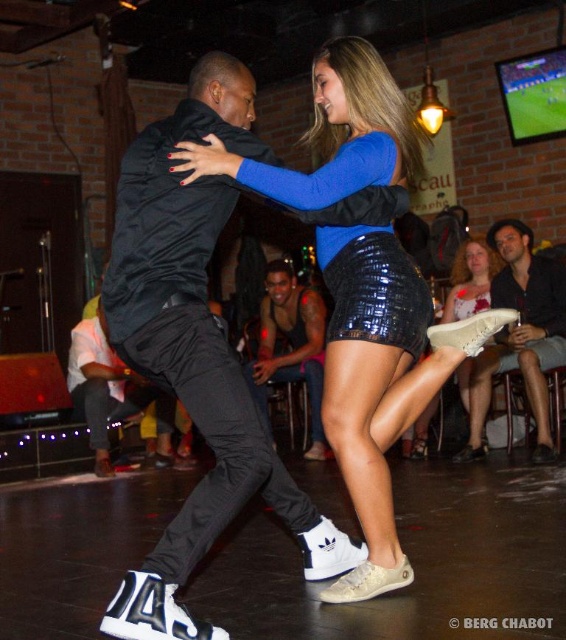
Who is positioned more to the right, black leather tank top at center or black matte pants at center?

black leather tank top at center

Does point (276, 321) come closer to viewer compared to point (74, 388)?

No, it is not.

The height and width of the screenshot is (640, 566). I want to click on black leather tank top at center, so click(291, 346).

Does point (374, 74) come in front of point (465, 268)?

That is True.

Is blue shiny skirt at center in front of white matte shoe at lower center?

Yes.

The width and height of the screenshot is (566, 640). In order to click on blue shiny skirt at center in this screenshot , I will do `click(380, 381)`.

Does white leather shoe at lower right appear on the left side of white matte shoe at lower center?

Incorrect, white leather shoe at lower right is not on the left side of white matte shoe at lower center.

Can you confirm if white leather shoe at lower right is wider than white matte shoe at lower center?

Yes.

Describe the element at coordinates (520, 333) in the screenshot. I see `white leather shoe at lower right` at that location.

Image resolution: width=566 pixels, height=640 pixels. Identify the location of white leather shoe at lower right. (520, 333).